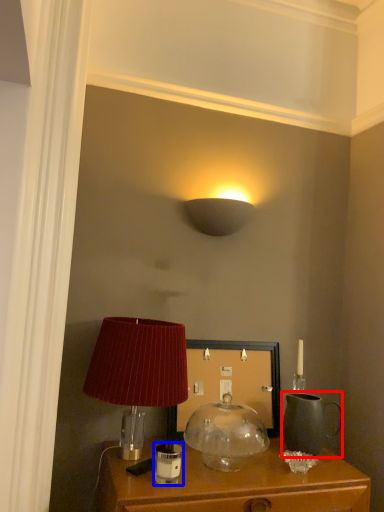
Question: Which object appears closest to the camera in this image, tea pot (highlighted by a red box) or candle holder (highlighted by a blue box)?

Choices:
 (A) tea pot
 (B) candle holder

Answer: (B)